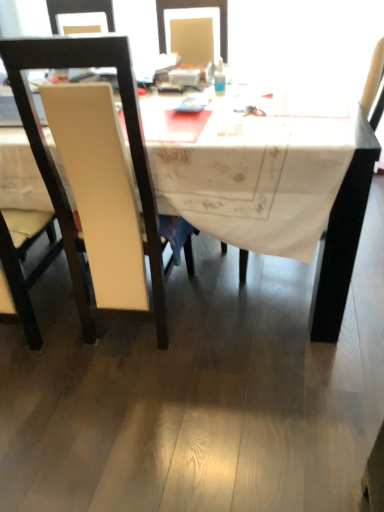
Locate an element on the screen. Image resolution: width=384 pixels, height=512 pixels. vacant point to the left of translucent plastic bottle at upper center is located at coordinates (177, 96).